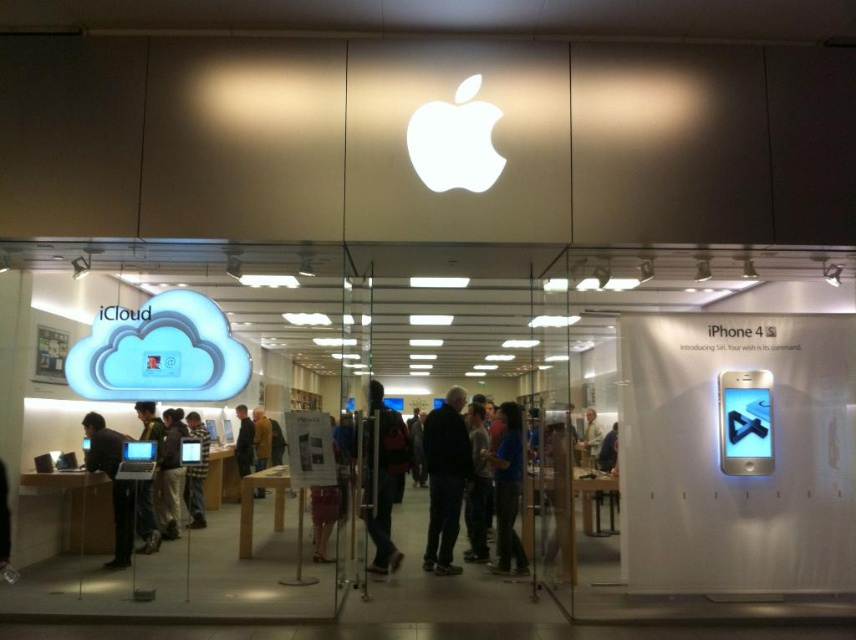
Which is behind, point (126, 488) or point (516, 449)?

Point (516, 449)

Between matte black laptop at left and blue fabric shirt at center, which one appears on the right side from the viewer's perspective?

blue fabric shirt at center

Does point (158, 532) come closer to viewer compared to point (509, 499)?

Yes, point (158, 532) is closer to viewer.

Identify the location of matte black laptop at left. (119, 492).

Does black backpack at center come in front of matte silver laptop at center?

Yes, black backpack at center is closer to the viewer.

Does point (379, 416) lie behind point (144, 529)?

Yes, point (379, 416) is farther from viewer.

Where is `black backpack at center`? black backpack at center is located at coordinates (381, 476).

Who is shorter, matte silver laptop at center or brown leather jacket at center?

matte silver laptop at center

Which is behind, point (146, 531) or point (268, 429)?

The point (268, 429) is more distant.

Does point (150, 538) come closer to viewer compared to point (253, 416)?

That is True.

You are a GUI agent. You are given a task and a screenshot of the screen. Output one action in this format:
    pyautogui.click(x=<x>, y=<y>)
    Task: Click on the matte silver laptop at center
    Image resolution: width=856 pixels, height=640 pixels.
    Given the screenshot: What is the action you would take?
    pyautogui.click(x=146, y=516)